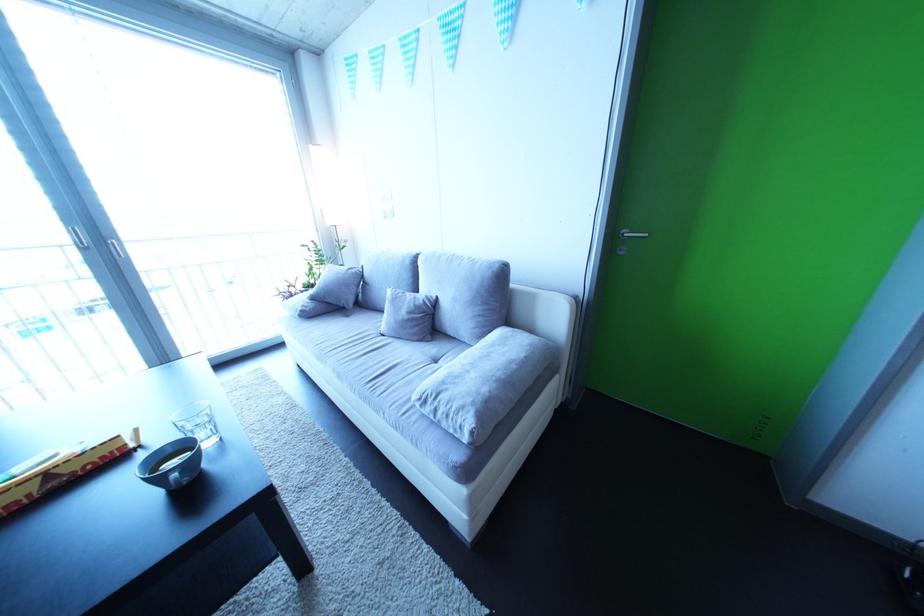
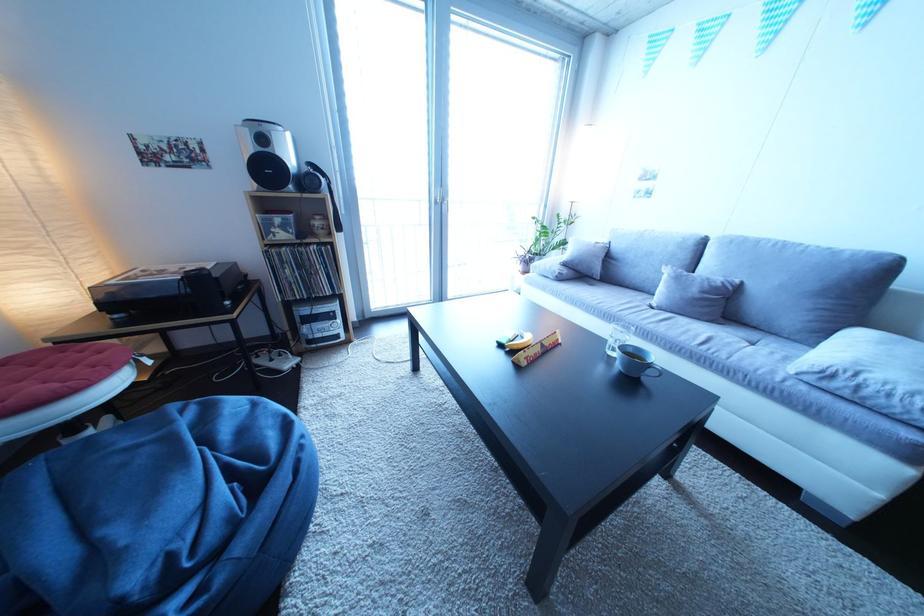
Where in the second image is the point corresponding to (x=334, y=365) from the first image?

(622, 323)